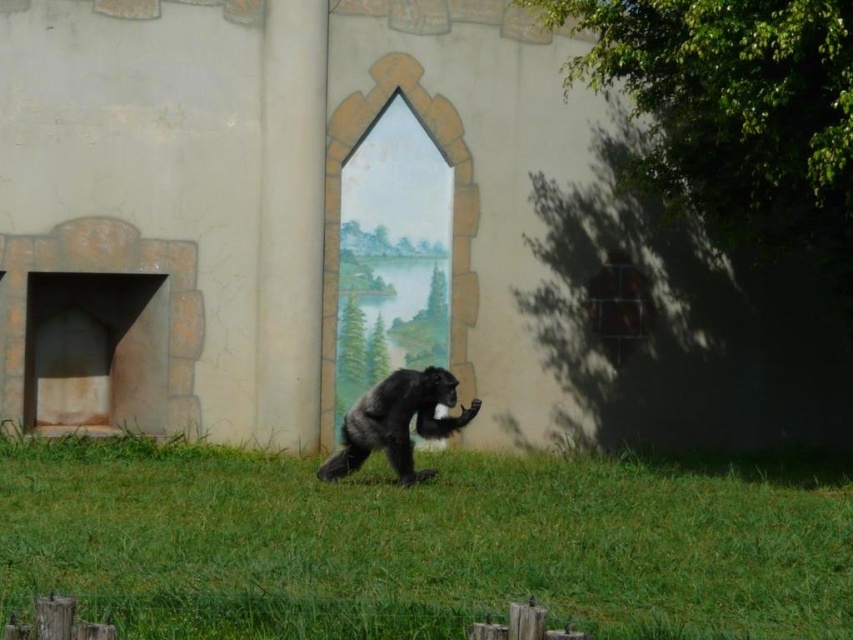
You are a photographer standing in front of the chimpanzee. You want to capture a clear photo of the shiny black ape at center without any obstruction. Based on the scene, can you position yourself so that the green grass at center does not block your view?

The green grass at center is positioned under the shiny black ape at center, so if you position yourself directly in front of the shiny black ape at center, the grass will be beneath it and not obstruct your view.

From the picture: You are standing in front of the wall with the painted mural and see the green grass at center and the shiny black ape at center. Which object is closer to you?

The green grass at center is closer to the viewer than the shiny black ape at center.